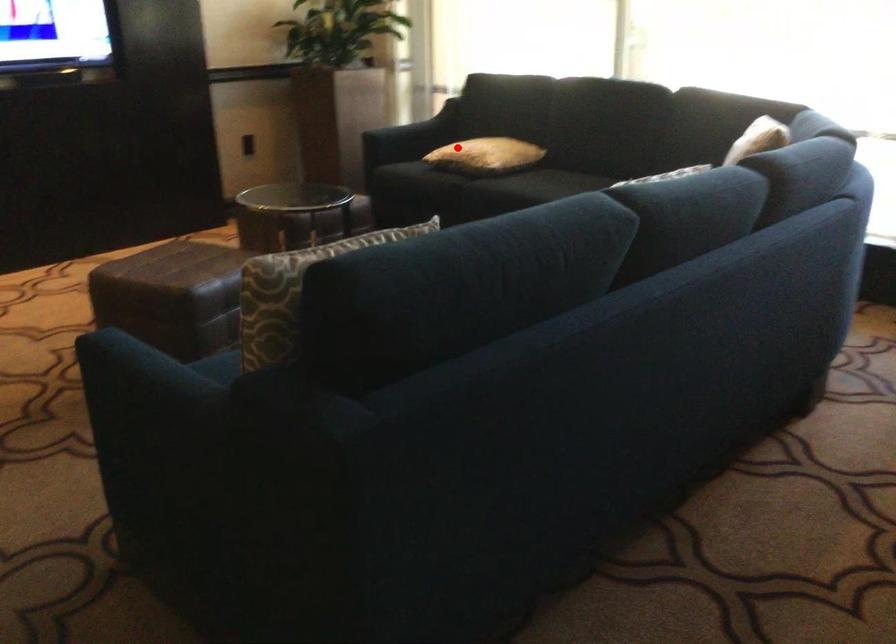
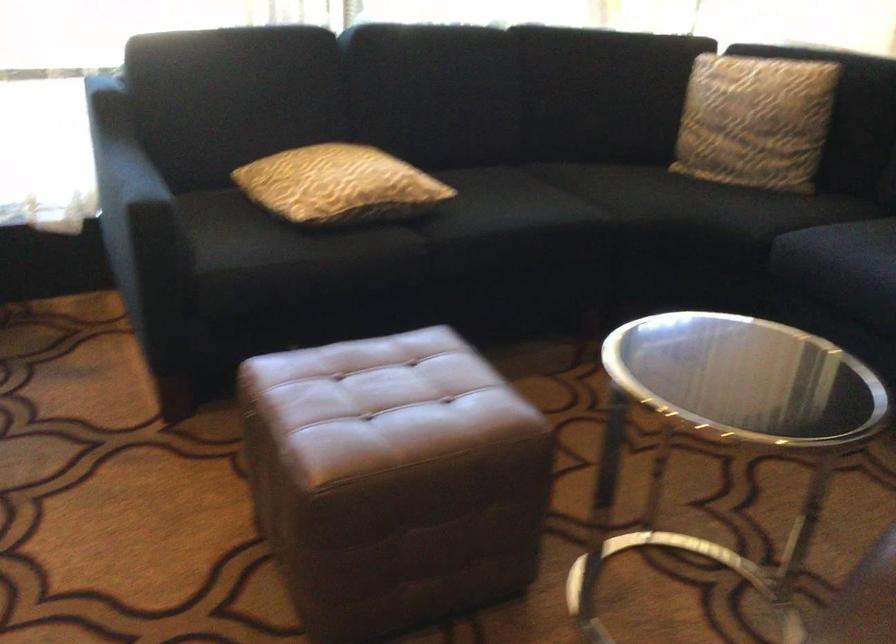
Question: I am providing you with two images of the same scene from different viewpoints. Image1 has a red point marked. In image2, the corresponding 3D location appears at what relative position? Reply with the corresponding letter.

Choices:
 (A) Closer
 (B) Farther

Answer: (A)